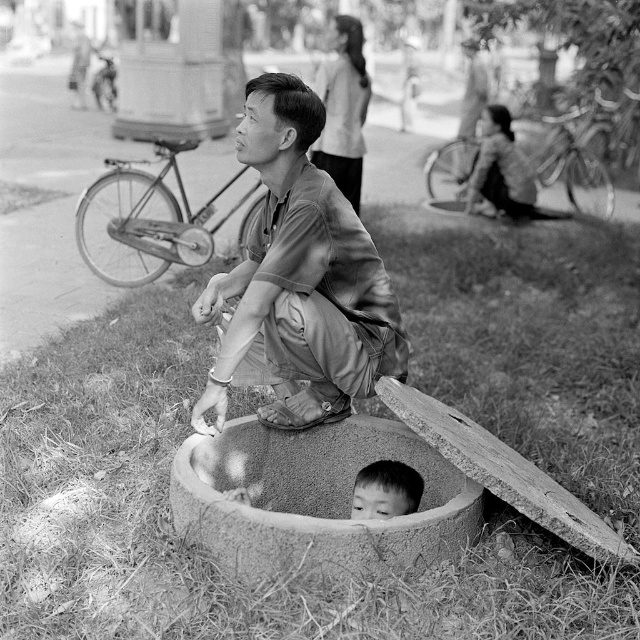
You are a photographer analyzing this black and white photo. You notice the matte brown shirt at center and the smooth concrete basin at lower center. Which object takes up more space in the image?

The matte brown shirt at center takes up more space in the image as it is larger in size than the smooth concrete basin at lower center.